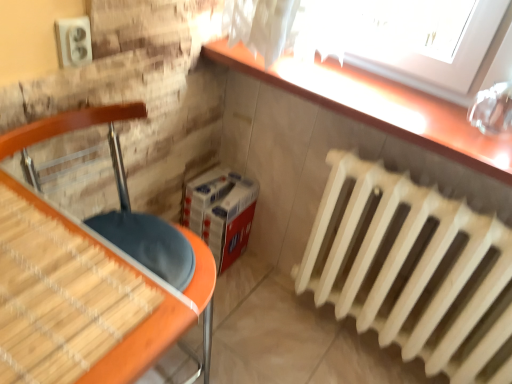
Question: Is matte orange table at lower left positioned before smooth wooden counter at upper right?

Choices:
 (A) yes
 (B) no

Answer: (A)

Question: From the image's perspective, is matte orange table at lower left over smooth wooden counter at upper right?

Choices:
 (A) yes
 (B) no

Answer: (B)

Question: Can you confirm if matte orange table at lower left is taller than smooth wooden counter at upper right?

Choices:
 (A) yes
 (B) no

Answer: (A)

Question: Is matte orange table at lower left shorter than smooth wooden counter at upper right?

Choices:
 (A) yes
 (B) no

Answer: (B)

Question: Is matte orange table at lower left at the right side of smooth wooden counter at upper right?

Choices:
 (A) yes
 (B) no

Answer: (B)

Question: Is matte orange table at lower left wider than smooth wooden counter at upper right?

Choices:
 (A) no
 (B) yes

Answer: (B)

Question: Can white wooden radiator at lower right be found inside smooth wooden counter at upper right?

Choices:
 (A) yes
 (B) no

Answer: (B)

Question: Does smooth wooden counter at upper right turn towards white wooden radiator at lower right?

Choices:
 (A) no
 (B) yes

Answer: (A)

Question: Does smooth wooden counter at upper right have a lesser height compared to white wooden radiator at lower right?

Choices:
 (A) yes
 (B) no

Answer: (A)

Question: From a real-world perspective, does smooth wooden counter at upper right sit lower than white wooden radiator at lower right?

Choices:
 (A) no
 (B) yes

Answer: (A)

Question: Would you consider smooth wooden counter at upper right to be distant from white wooden radiator at lower right?

Choices:
 (A) no
 (B) yes

Answer: (A)

Question: Is white wooden radiator at lower right at the back of smooth wooden counter at upper right?

Choices:
 (A) no
 (B) yes

Answer: (A)

Question: From a real-world perspective, is matte orange table at lower left over white wooden radiator at lower right?

Choices:
 (A) yes
 (B) no

Answer: (A)